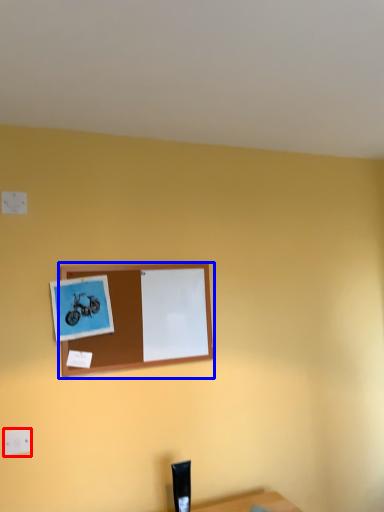
Question: Which point is closer to the camera, electric outlet (highlighted by a red box) or picture frame (highlighted by a blue box)?

Choices:
 (A) electric outlet
 (B) picture frame

Answer: (A)